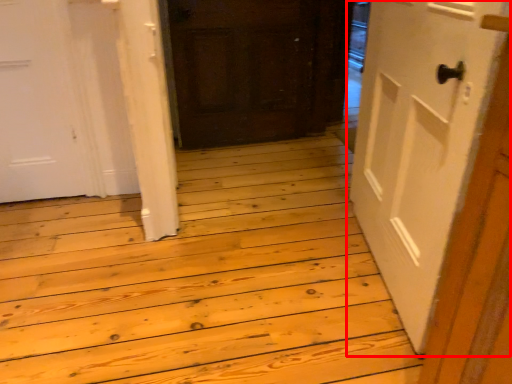
Question: Where is door (annotated by the red box) located in relation to door in the image?

Choices:
 (A) right
 (B) left

Answer: (A)